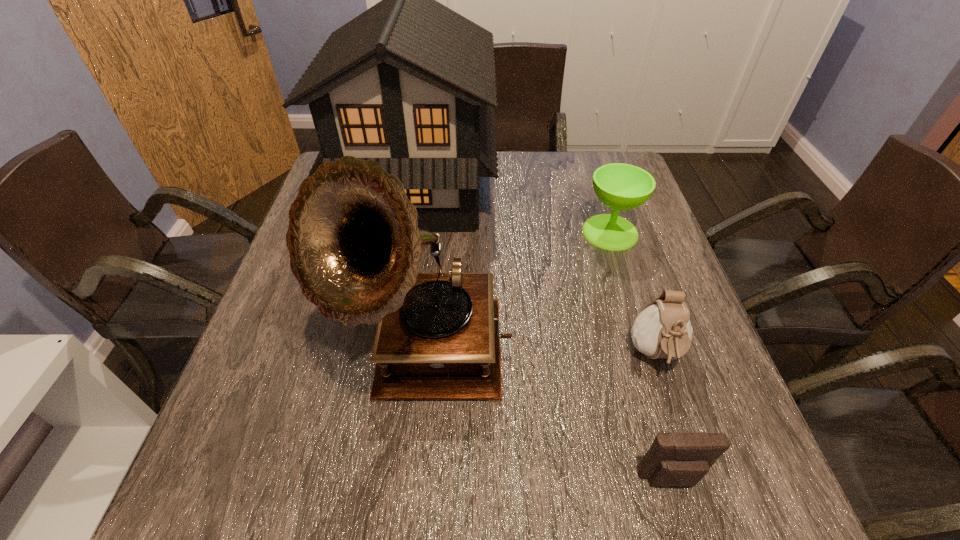
Where is `dollhouse`? The height and width of the screenshot is (540, 960). dollhouse is located at coordinates (409, 83).

You are a GUI agent. You are given a task and a screenshot of the screen. Output one action in this format:
    pyautogui.click(x=<x>, y=<y>)
    Task: Click on the record player
    This screenshot has height=540, width=960.
    Given the screenshot: What is the action you would take?
    pyautogui.click(x=353, y=238)

Locate an element on the screen. The height and width of the screenshot is (540, 960). wineglass is located at coordinates (620, 186).

Locate an element on the screen. the taller pouch is located at coordinates (662, 330).

Locate an element on the screen. The width and height of the screenshot is (960, 540). the shortest object is located at coordinates (678, 458).

Where is `the nearer pouch`? the nearer pouch is located at coordinates click(678, 458).

Where is `free space located on the front-facing side of the dollhouse`? This screenshot has height=540, width=960. free space located on the front-facing side of the dollhouse is located at coordinates (631, 192).

At what (x,y) coordinates should I click in order to perform the action: click on free space located on the horn of the record player. Please return your answer as a coordinate pair (x, y). This screenshot has width=960, height=540. Looking at the image, I should click on (413, 483).

Locate an element on the screen. blank area located on the back of the wineglass is located at coordinates (595, 184).

This screenshot has height=540, width=960. Find the location of `blank area located on the front-facing side of the taller pouch`. blank area located on the front-facing side of the taller pouch is located at coordinates [x=705, y=503].